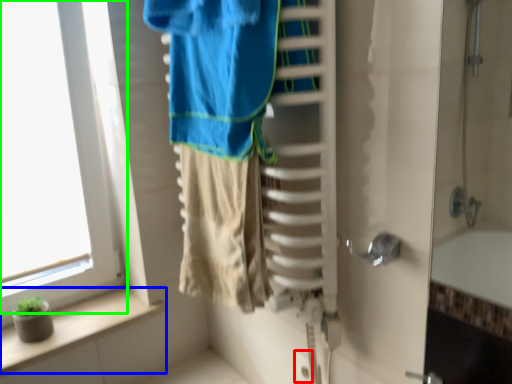
Question: Which object is positioned farthest from electric outlet (highlighted by a red box)? Select from balustrade (highlighted by a blue box) and window (highlighted by a green box).

Choices:
 (A) balustrade
 (B) window

Answer: (B)